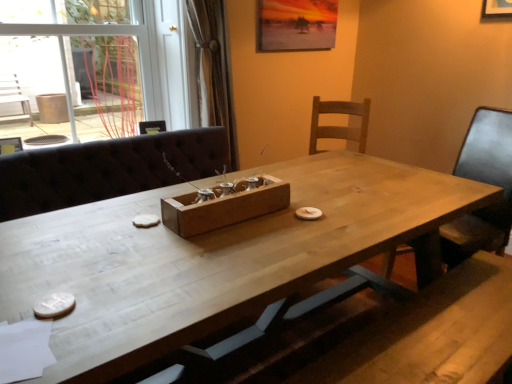
In order to click on free location in front of wooden tray at center in this screenshot , I will do (x=222, y=254).